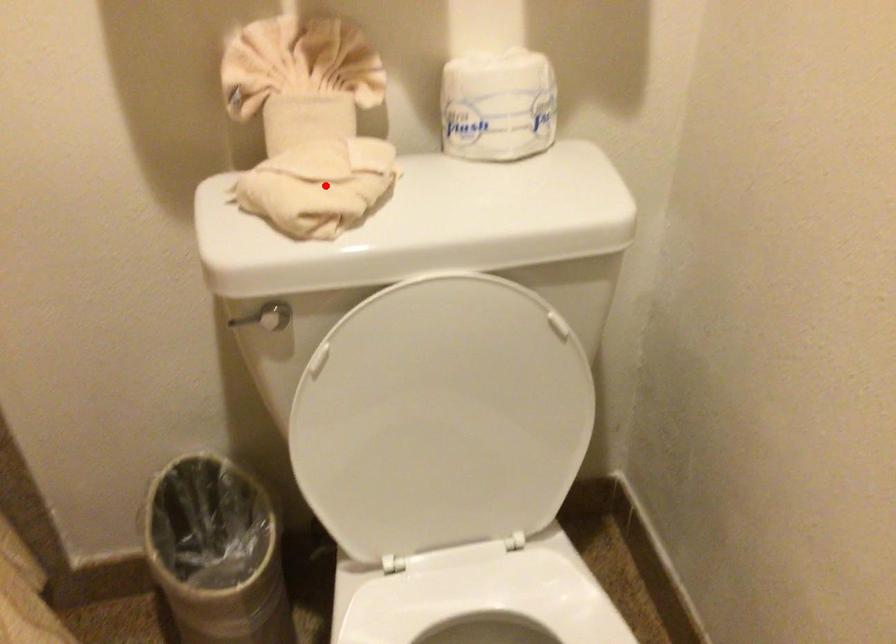
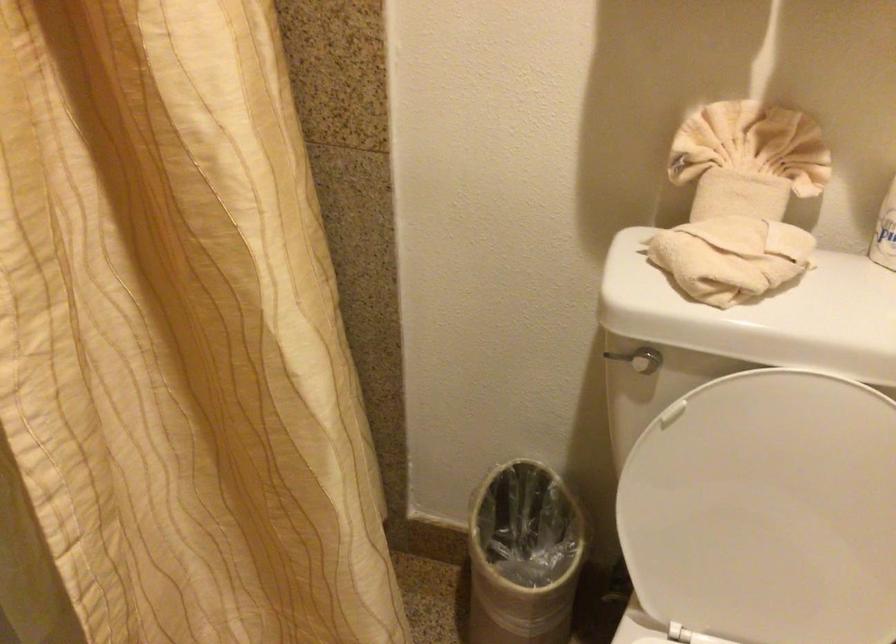
Find the pixel in the second image that matches the highlighted location in the first image.

(730, 257)